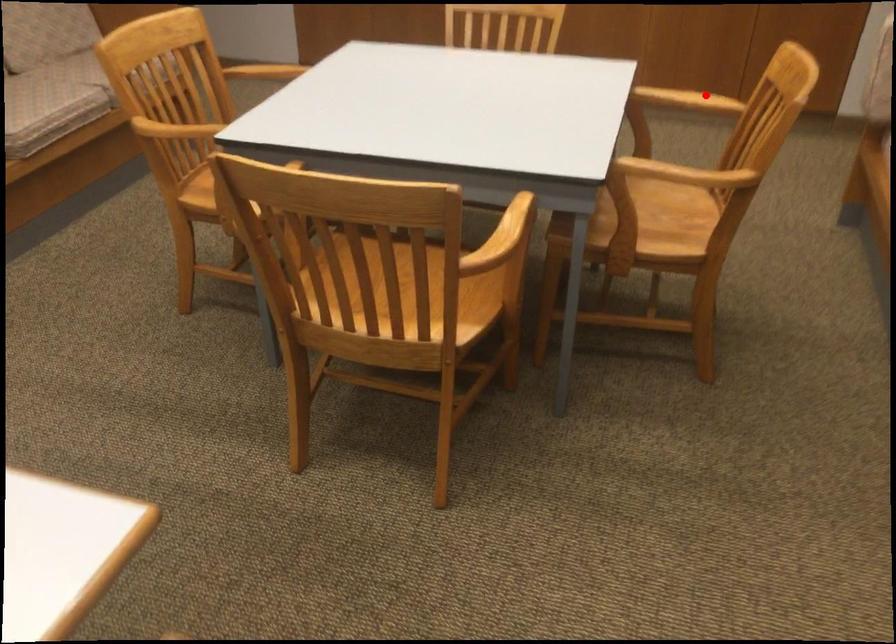
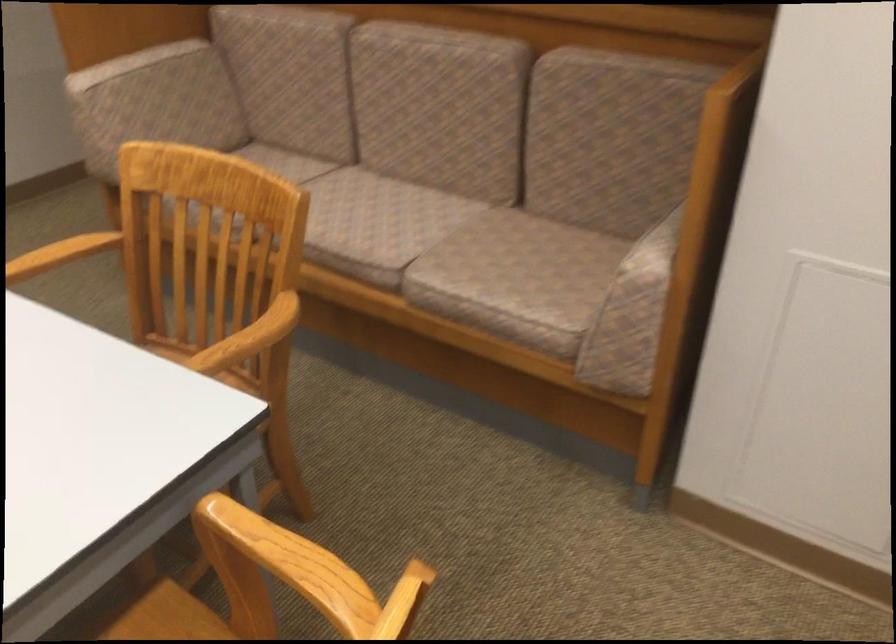
Locate, in the second image, the point that corresponds to the highlighted location in the first image.

(62, 252)